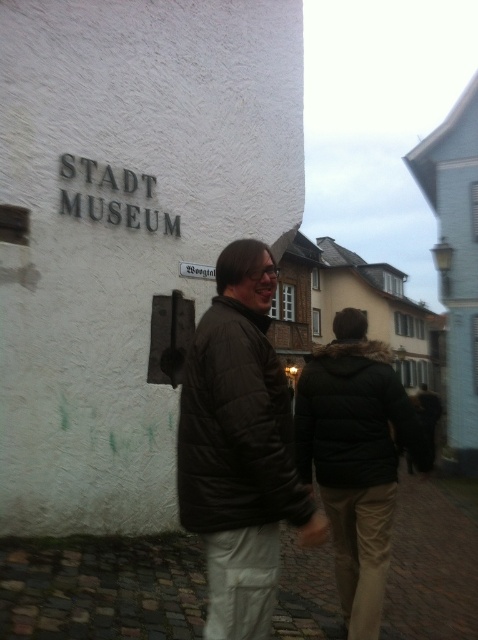
Question: Which of the following is the closest to the observer?

Choices:
 (A) dark brown quilted jacket at center
 (B) white plastic sign at center
 (C) dark green jacket at center

Answer: (A)

Question: Does dark brown quilted jacket at center appear on the left side of dark green jacket at center?

Choices:
 (A) yes
 (B) no

Answer: (A)

Question: Among these objects, which one is farthest from the camera?

Choices:
 (A) dark green jacket at center
 (B) dark brown quilted jacket at center
 (C) white plastic sign at center

Answer: (C)

Question: Which point appears farthest from the camera in this image?

Choices:
 (A) (383, 595)
 (B) (267, 257)
 (C) (188, 276)

Answer: (C)

Question: Considering the relative positions of dark brown quilted jacket at center and dark green jacket at center in the image provided, where is dark brown quilted jacket at center located with respect to dark green jacket at center?

Choices:
 (A) below
 (B) above

Answer: (B)

Question: Considering the relative positions of dark green jacket at center and white plastic sign at center in the image provided, where is dark green jacket at center located with respect to white plastic sign at center?

Choices:
 (A) left
 (B) right

Answer: (B)